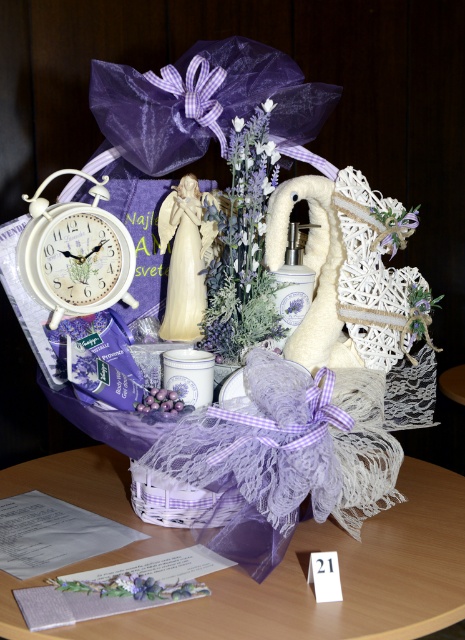
Question: Which object appears farthest from the camera in this image?

Choices:
 (A) lavender fabric basket at center
 (B) lavender lace basket at center

Answer: (A)

Question: Among these objects, which one is nearest to the camera?

Choices:
 (A) white porcelain figurine at center
 (B) lavender fabric basket at center
 (C) lavender fabric flower at center

Answer: (B)

Question: Is white porcelain figurine at center wider than lavender fabric basket at center?

Choices:
 (A) yes
 (B) no

Answer: (B)

Question: Can you confirm if lavender lace basket at center is smaller than lavender fabric flower at center?

Choices:
 (A) yes
 (B) no

Answer: (B)

Question: Considering the real-world distances, which object is farthest from the white porcelain figurine at center?

Choices:
 (A) lavender lace basket at center
 (B) lavender fabric basket at center

Answer: (A)

Question: Is white porcelain figurine at center above lavender fabric basket at center?

Choices:
 (A) no
 (B) yes

Answer: (B)